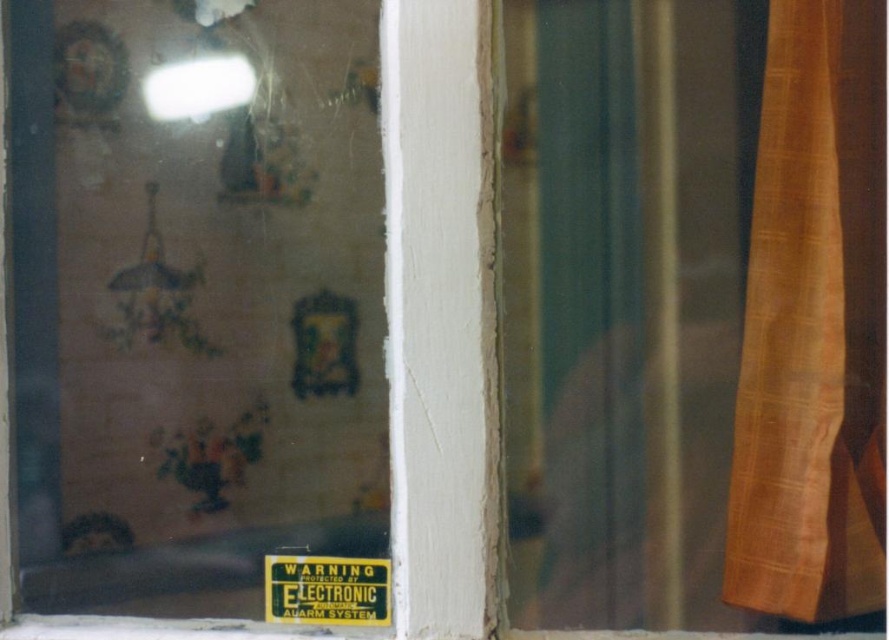
Question: Can you confirm if orange woven fabric curtain at right is positioned below yellow/black electronic sign at center?

Choices:
 (A) no
 (B) yes

Answer: (A)

Question: Which point is farther to the camera?

Choices:
 (A) transparent glass window at upper left
 (B) orange woven fabric curtain at right

Answer: (A)

Question: Is orange woven fabric curtain at right to the right of yellow/black electronic sign at center from the viewer's perspective?

Choices:
 (A) no
 (B) yes

Answer: (B)

Question: Which of the following is the farthest from the observer?

Choices:
 (A) yellow/black electronic sign at center
 (B) transparent glass window at upper left

Answer: (B)

Question: Considering the real-world distances, which object is closest to the transparent glass window at upper left?

Choices:
 (A) yellow/black electronic sign at center
 (B) orange woven fabric curtain at right

Answer: (A)

Question: Does transparent glass window at upper left have a lesser width compared to orange woven fabric curtain at right?

Choices:
 (A) yes
 (B) no

Answer: (B)